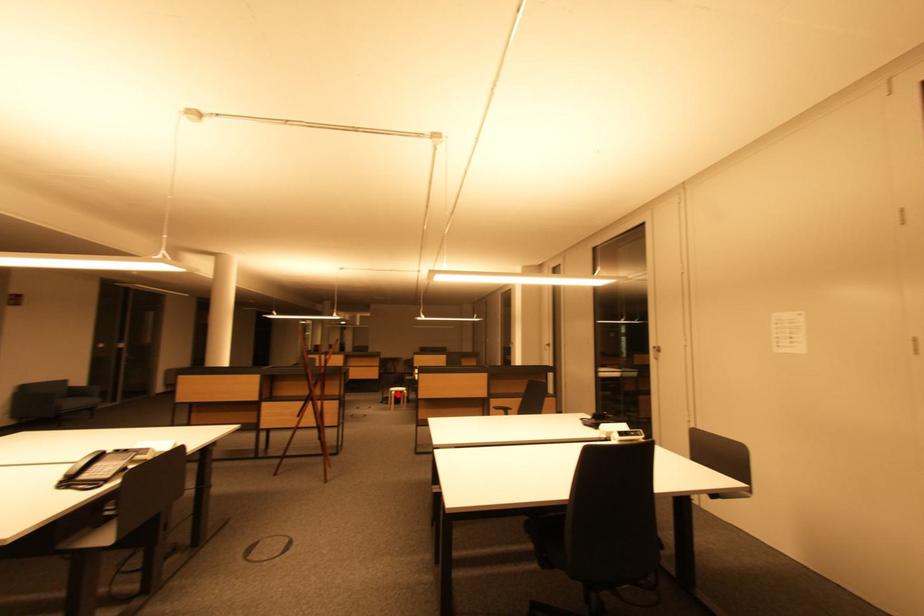
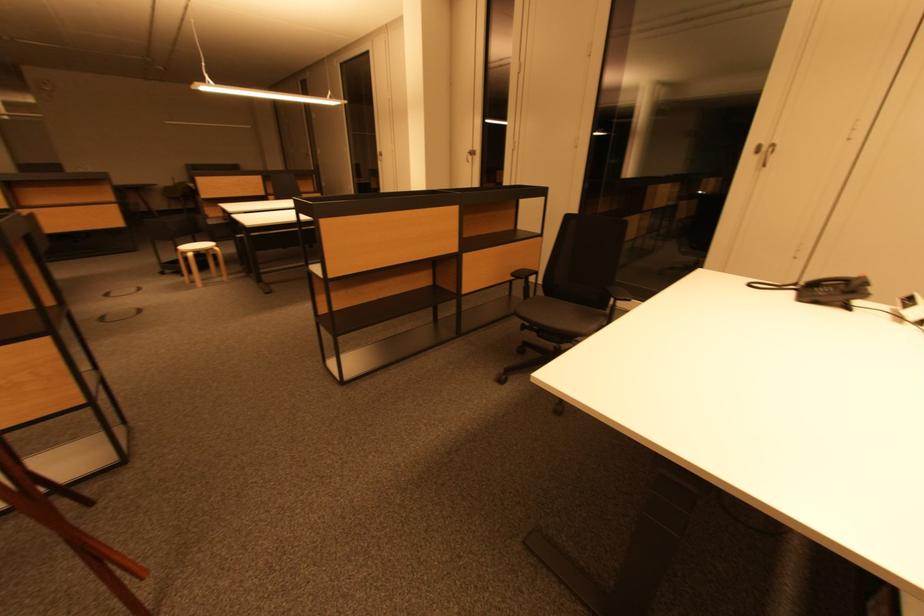
Question: I am providing you with two images of the same scene from different viewpoints. Image1 has a red point marked. In image2, the corresponding 3D location appears at what relative position? Reply with the corresponding letter.

Choices:
 (A) Closer
 (B) Farther

Answer: (A)